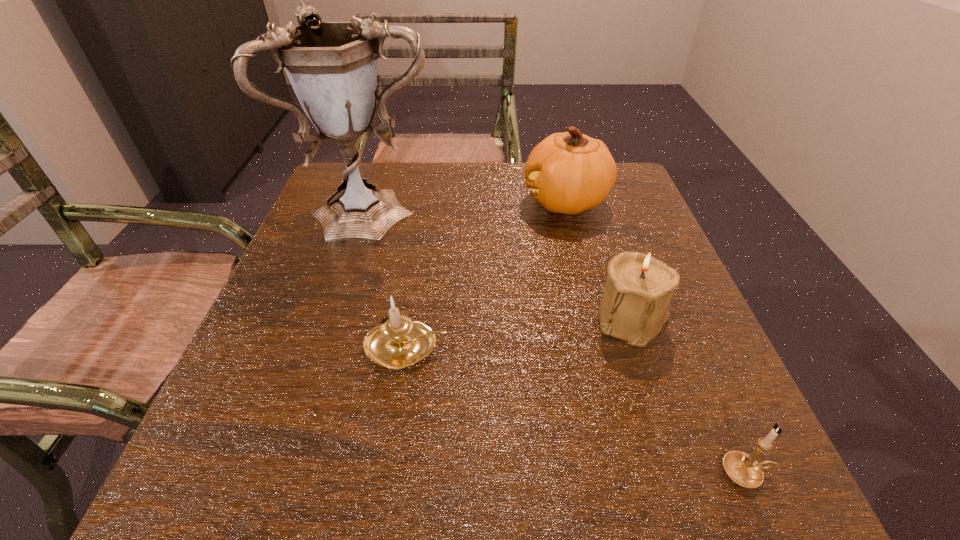
The image size is (960, 540). In order to click on vacant area that satisfies the following two spatial constraints: 1. on the front side of the third shortest object; 2. on the handle side of the leftmost candle holder in this screenshot , I will do `click(642, 347)`.